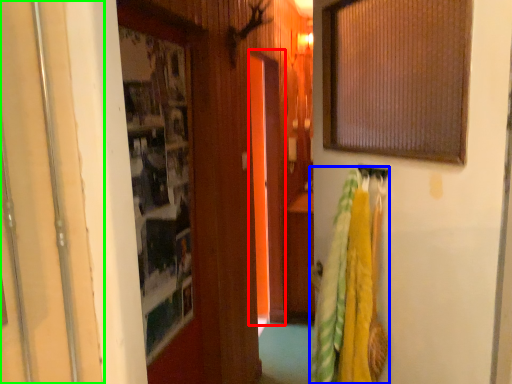
Question: Considering the real-world distances, which object is closest to screen door (highlighted by a red box)? laundry (highlighted by a blue box) or door (highlighted by a green box).

Choices:
 (A) laundry
 (B) door

Answer: (A)